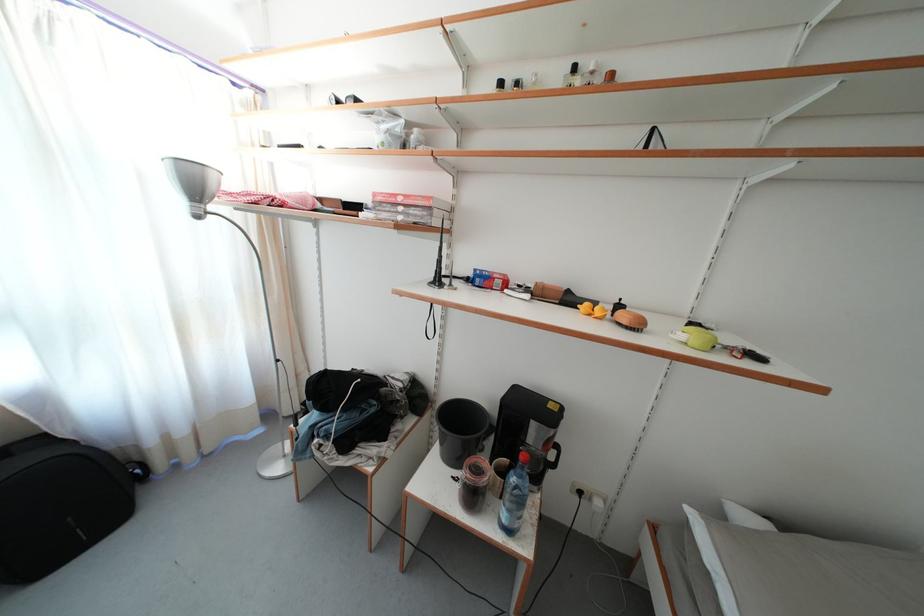
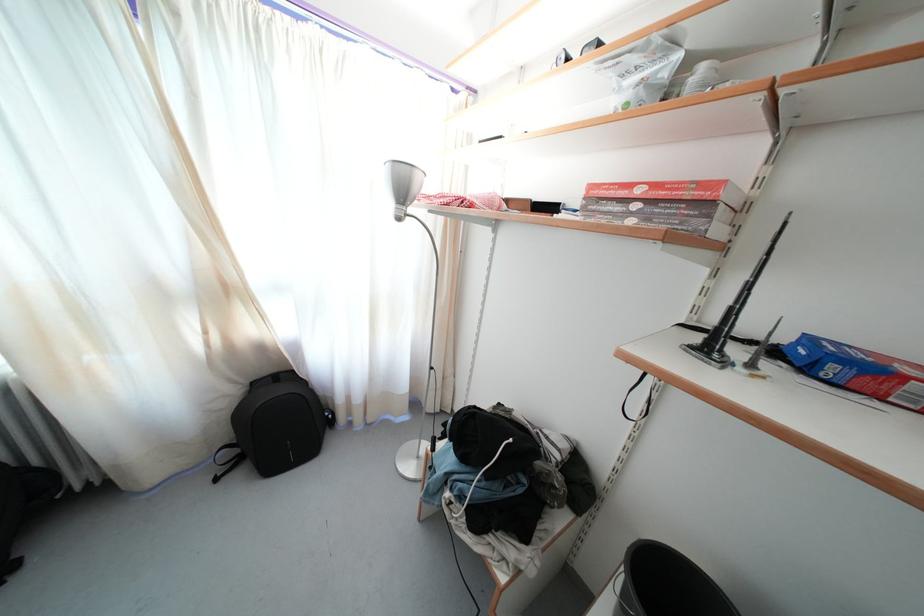
Find the pixel in the second image that matches pixel 456 291 in the first image.

(757, 371)